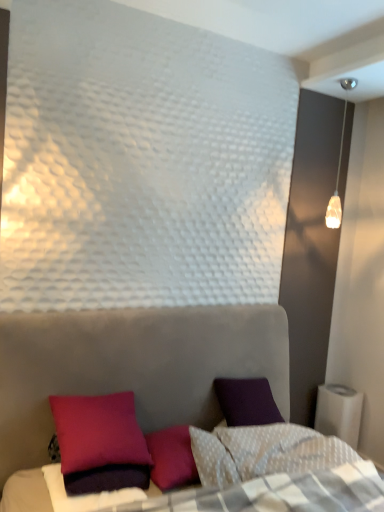
Question: Is purple matte pillow at lower left outside translucent glass pendant light at upper right?

Choices:
 (A) no
 (B) yes

Answer: (B)

Question: Is purple matte pillow at lower left wider than translucent glass pendant light at upper right?

Choices:
 (A) no
 (B) yes

Answer: (B)

Question: Does purple matte pillow at lower left have a lesser width compared to translucent glass pendant light at upper right?

Choices:
 (A) no
 (B) yes

Answer: (A)

Question: From a real-world perspective, is purple matte pillow at lower left physically below translucent glass pendant light at upper right?

Choices:
 (A) yes
 (B) no

Answer: (A)

Question: Is purple matte pillow at lower left facing away from translucent glass pendant light at upper right?

Choices:
 (A) yes
 (B) no

Answer: (B)

Question: Is purple matte pillow at lower left closer to camera compared to translucent glass pendant light at upper right?

Choices:
 (A) no
 (B) yes

Answer: (B)

Question: Could velvet purple pillow at lower left be considered to be inside purple matte pillow at lower left?

Choices:
 (A) yes
 (B) no

Answer: (B)

Question: Is purple matte pillow at lower left to the left of velvet purple pillow at lower left from the viewer's perspective?

Choices:
 (A) yes
 (B) no

Answer: (A)

Question: Considering the relative sizes of purple matte pillow at lower left and velvet purple pillow at lower left in the image provided, is purple matte pillow at lower left smaller than velvet purple pillow at lower left?

Choices:
 (A) yes
 (B) no

Answer: (A)

Question: Is purple matte pillow at lower left shorter than velvet purple pillow at lower left?

Choices:
 (A) no
 (B) yes

Answer: (B)

Question: Is purple matte pillow at lower left thinner than velvet purple pillow at lower left?

Choices:
 (A) no
 (B) yes

Answer: (B)

Question: Is purple matte pillow at lower left at the right side of velvet purple pillow at lower left?

Choices:
 (A) yes
 (B) no

Answer: (B)

Question: From the image's perspective, is translucent glass pendant light at upper right under velvet purple pillow at lower left?

Choices:
 (A) yes
 (B) no

Answer: (B)